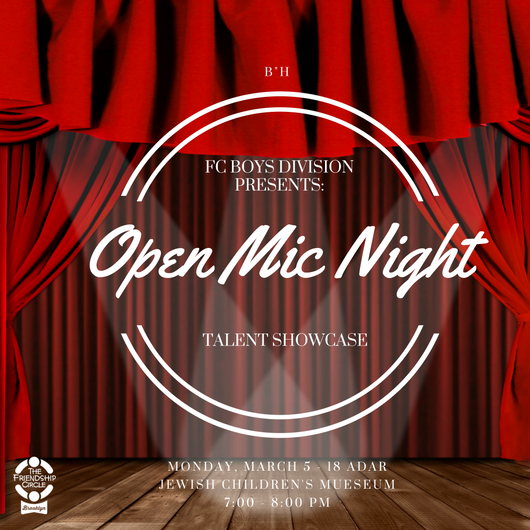
This screenshot has width=530, height=530. Identify the location of two side curtains. (475, 178), (69, 193).